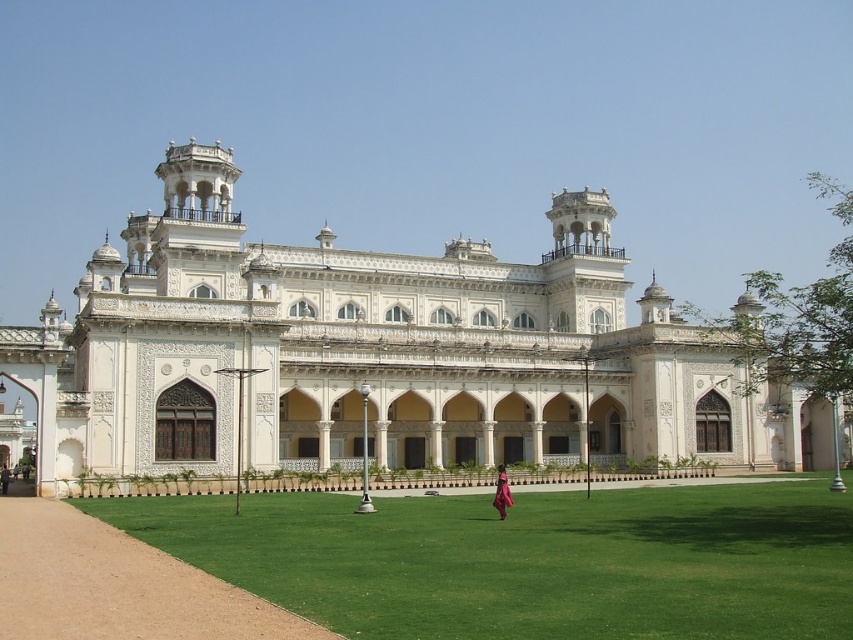
You are standing at the point marked by the coordinates point (x=527, y=561) in the image. What is the name of the surface you are currently standing on?

The surface you are standing on is the green grass at center, as the point (x=527, y=561) corresponds to this location in the image.

You are a landscape architect designing a garden for the white marble palace at center. Considering the green grass at center is already present, how does the size of the palace compare to the grass area?

The white marble palace at center is larger in size than the green grass at center, so the palace occupies a bigger area than the grass.

You are a photographer planning to take a photo of the white marble palace at center and the pink silk dress at center from the lawn. Which object should you focus on first to ensure both are in the frame?

The white marble palace at center is positioned over the pink silk dress at center, so you should focus on the palace first to ensure both are visible in the frame.